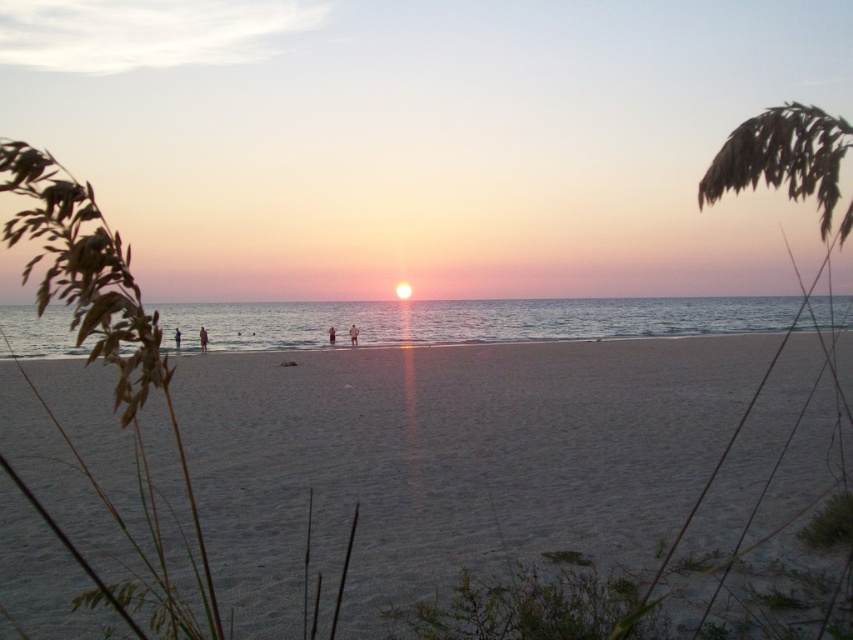
Question: Which object appears farthest from the camera in this image?

Choices:
 (A) skinny jeans at center
 (B) dark red fabric person at center

Answer: (B)

Question: Which point appears farthest from the camera in this image?

Choices:
 (A) (328, 339)
 (B) (177, 332)
 (C) (631, 458)

Answer: (A)

Question: Can you confirm if orange fabric person at center is wider than dark red fabric person at center?

Choices:
 (A) yes
 (B) no

Answer: (A)

Question: Can you confirm if orange fabric person at center is thinner than dark red fabric person at center?

Choices:
 (A) yes
 (B) no

Answer: (B)

Question: Is orange fabric person at center thinner than dark blue fabric person at center?

Choices:
 (A) yes
 (B) no

Answer: (A)

Question: Which of the following is the farthest from the observer?

Choices:
 (A) (201, 324)
 (B) (332, 332)
 (C) (389, 419)

Answer: (A)